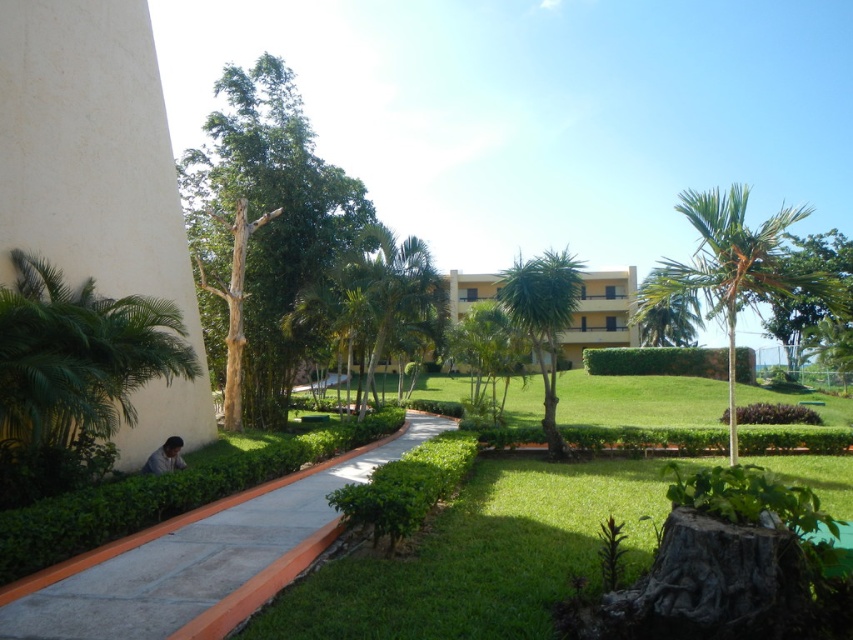
Is point (56, 596) farther from camera compared to point (85, 349)?

No, (56, 596) is in front of (85, 349).

At what (x,y) coordinates should I click in order to perform the action: click on concrete at center. Please return your answer as a coordinate pair (x, y). Looking at the image, I should click on [202, 561].

Can you confirm if green leafy palm at lower left is taller than green leafy palm tree at upper right?

Incorrect, green leafy palm at lower left's height is not larger of green leafy palm tree at upper right's.

Is point (15, 253) positioned in front of point (704, 300)?

Yes.

Locate an element on the screen. green leafy palm at lower left is located at coordinates (79, 356).

Does green leafy tree at upper right appear over yellow matte building at center?

No, green leafy tree at upper right is not above yellow matte building at center.

Can you confirm if green leafy tree at upper right is smaller than yellow matte building at center?

Incorrect, green leafy tree at upper right is not smaller in size than yellow matte building at center.

This screenshot has height=640, width=853. What are the coordinates of `green leafy tree at upper right` in the screenshot? It's located at (816, 304).